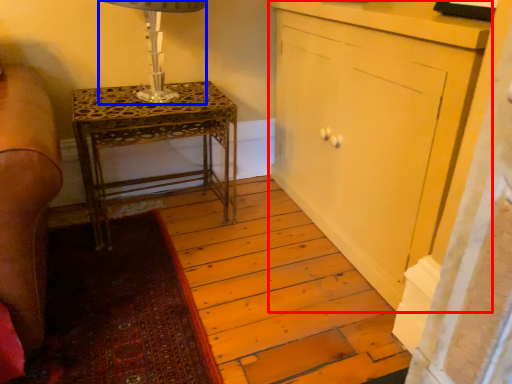
Question: Which object appears farthest to the camera in this image, cabinetry (highlighted by a red box) or table lamp (highlighted by a blue box)?

Choices:
 (A) cabinetry
 (B) table lamp

Answer: (B)